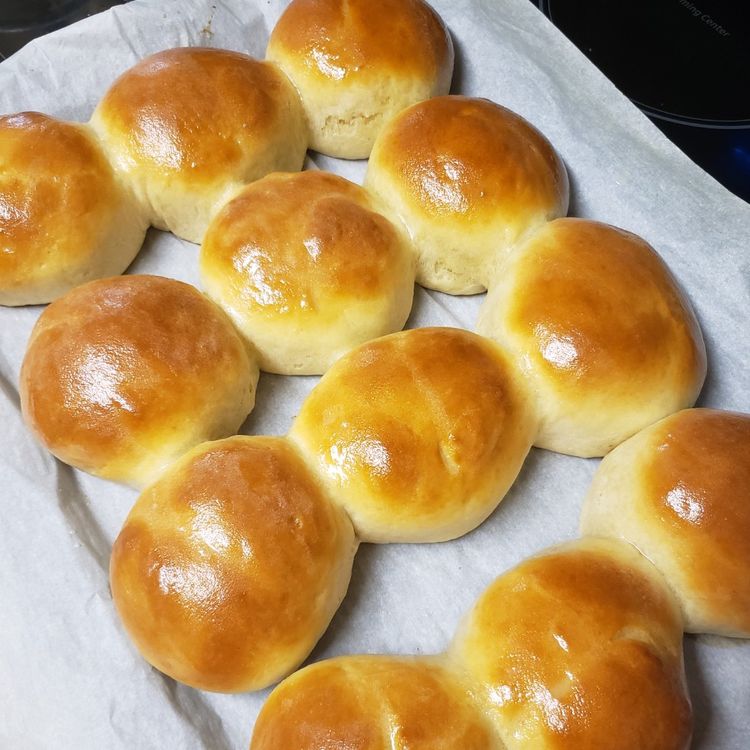
Locate an element on the screen. stovetop is located at coordinates (687, 91).